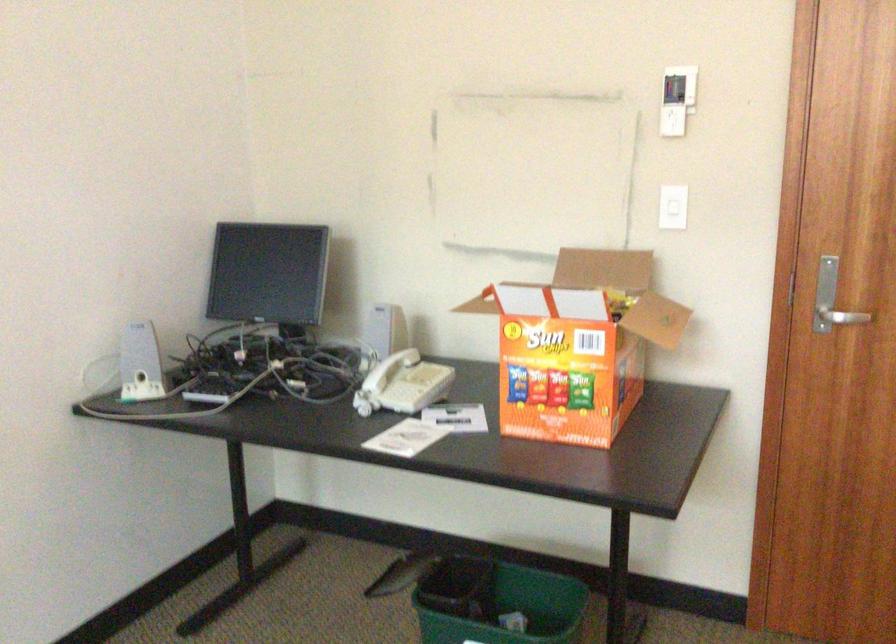
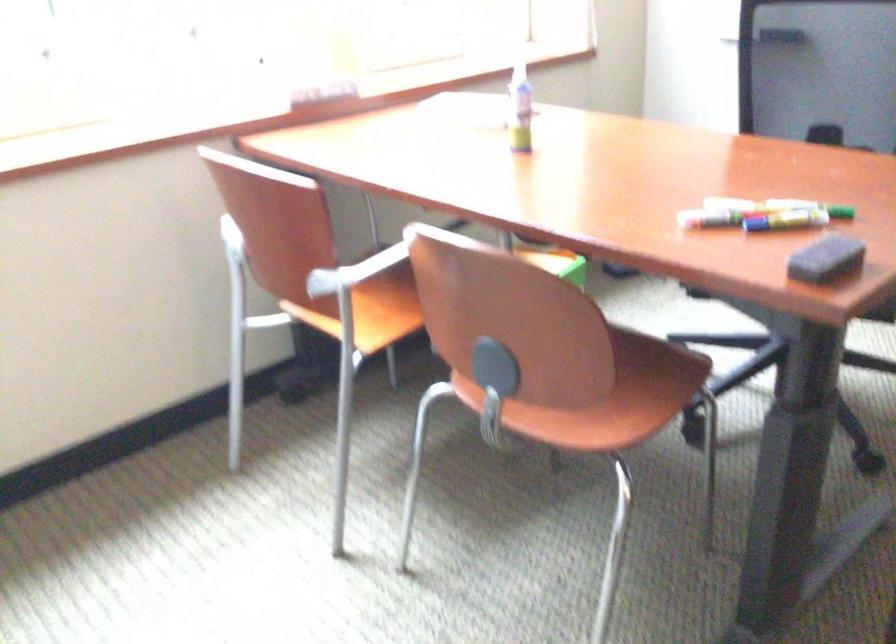
The images are taken continuously from a first-person perspective. In which direction is your viewpoint rotating?

The camera rotated toward left-down.